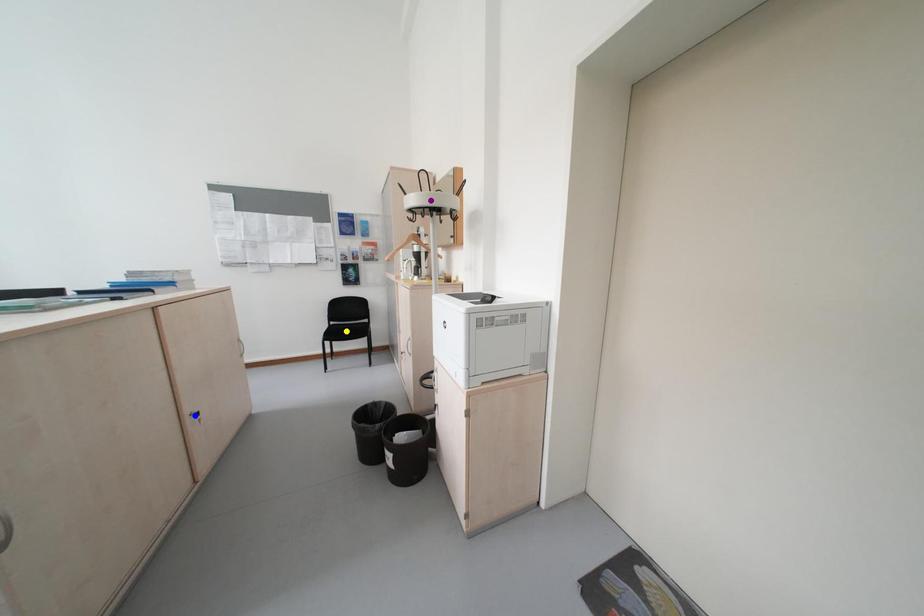
Order these from nearest to farthest:
1. yellow point
2. blue point
3. purple point

blue point, purple point, yellow point